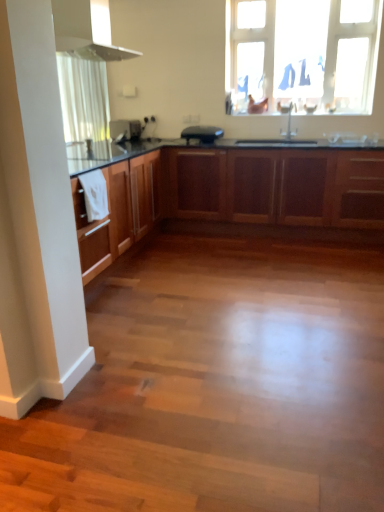
Locate an element on the screen. transparent plastic window at upper center is located at coordinates (305, 52).

Describe the element at coordinates (305, 52) in the screenshot. The image size is (384, 512). I see `transparent plastic window at upper center` at that location.

This screenshot has height=512, width=384. What are the coordinates of `white sheer curtain at upper left` in the screenshot? It's located at (83, 99).

Describe the element at coordinates (83, 99) in the screenshot. I see `white sheer curtain at upper left` at that location.

Where is `wooden cabinets at center`? Image resolution: width=384 pixels, height=512 pixels. wooden cabinets at center is located at coordinates (231, 192).

The width and height of the screenshot is (384, 512). Describe the element at coordinates (202, 133) in the screenshot. I see `black matte toaster at center, the 2th appliance positioned from the left` at that location.

Measure the distance between point (212, 131) and camera.

Point (212, 131) is 4.62 meters from camera.

Identify the location of transparent plastic window at upper center. This screenshot has width=384, height=512. (305, 52).

Is black matte toaster at center, the 2th appliance positioned from the left, to the left of satin nickel faucet at upper center from the viewer's perspective?

Yes, black matte toaster at center, the 2th appliance positioned from the left, is to the left of satin nickel faucet at upper center.

From the image's perspective, is black matte toaster at center, placed as the first appliance when sorted from right to left, located beneath satin nickel faucet at upper center?

Correct, black matte toaster at center, placed as the first appliance when sorted from right to left, appears lower than satin nickel faucet at upper center in the image.

Can you confirm if black matte toaster at center, placed as the first appliance when sorted from right to left, is taller than satin nickel faucet at upper center?

In fact, black matte toaster at center, placed as the first appliance when sorted from right to left, may be shorter than satin nickel faucet at upper center.

Is black matte toaster at center, the 2th appliance positioned from the left, facing away from satin nickel faucet at upper center?

That's not correct — black matte toaster at center, the 2th appliance positioned from the left, is not looking away from satin nickel faucet at upper center.

Is white glossy exhaust hood at upper center facing away from wooden cabinets at center?

white glossy exhaust hood at upper center does not have its back to wooden cabinets at center.

Does point (109, 16) come closer to viewer compared to point (239, 210)?

No.

Choose the correct answer: Is white glossy exhaust hood at upper center inside wooden cabinets at center or outside it?

white glossy exhaust hood at upper center is not enclosed by wooden cabinets at center.

From a real-world perspective, is white glossy exhaust hood at upper center beneath wooden cabinets at center?

No, from a real-world perspective, white glossy exhaust hood at upper center is not under wooden cabinets at center.

From the image's perspective, between white sheer curtain at upper left and satin black toaster at center, the 1th appliance viewed from the left, who is located below?

From the image's view, satin black toaster at center, the 1th appliance viewed from the left, is below.

From a real-world perspective, which is physically above, white sheer curtain at upper left or satin black toaster at center, which is the second appliance in right-to-left order?

white sheer curtain at upper left is physically above.

In order to click on curtain above the satin black toaster at center, the 1th appliance viewed from the left (from a real-world perspective) in this screenshot , I will do `click(83, 99)`.

Can you tell me how much white sheer curtain at upper left and satin black toaster at center, which is the second appliance in right-to-left order, differ in facing direction?

They differ by 82.9 degrees in their facing directions.

Considering the positions of objects white sheer curtain at upper left and black matte toaster at center, placed as the first appliance when sorted from right to left, in the image provided, who is more to the right, white sheer curtain at upper left or black matte toaster at center, placed as the first appliance when sorted from right to left,?

black matte toaster at center, placed as the first appliance when sorted from right to left.

From a real-world perspective, does white sheer curtain at upper left stand above black matte toaster at center, the 2th appliance positioned from the left?

Correct, in the physical world, white sheer curtain at upper left is higher than black matte toaster at center, the 2th appliance positioned from the left.

Relative to black matte toaster at center, the 2th appliance positioned from the left, is white sheer curtain at upper left in front or behind?

Visually, white sheer curtain at upper left is located behind black matte toaster at center, the 2th appliance positioned from the left.

Is point (69, 70) positioned before point (219, 132)?

Yes, point (69, 70) is in front of point (219, 132).

How distant is transparent plastic window at upper center from satin black toaster at center, the 1th appliance viewed from the left?

transparent plastic window at upper center and satin black toaster at center, the 1th appliance viewed from the left, are 5.93 feet apart from each other.

Would you consider transparent plastic window at upper center to be distant from satin black toaster at center, which is the second appliance in right-to-left order?

That's right, there is a large distance between transparent plastic window at upper center and satin black toaster at center, which is the second appliance in right-to-left order.

Is satin black toaster at center, the 1th appliance viewed from the left, inside transparent plastic window at upper center?

Definitely not — satin black toaster at center, the 1th appliance viewed from the left, is not inside transparent plastic window at upper center.

From their relative heights in the image, would you say transparent plastic window at upper center is taller or shorter than satin black toaster at center, which is the second appliance in right-to-left order?

Clearly, transparent plastic window at upper center is taller compared to satin black toaster at center, which is the second appliance in right-to-left order.

Which object is closer to the camera taking this photo, satin black toaster at center, which is the second appliance in right-to-left order, or black matte toaster at center, the 2th appliance positioned from the left?

Positioned in front is black matte toaster at center, the 2th appliance positioned from the left.

Is satin black toaster at center, the 1th appliance viewed from the left, aimed at black matte toaster at center, placed as the first appliance when sorted from right to left?

Yes.

Based on their sizes in the image, would you say satin black toaster at center, the 1th appliance viewed from the left, is bigger or smaller than black matte toaster at center, the 2th appliance positioned from the left?

In the image, satin black toaster at center, the 1th appliance viewed from the left, appears to be smaller than black matte toaster at center, the 2th appliance positioned from the left.

Considering the sizes of black matte toaster at center, the 2th appliance positioned from the left, and wooden cabinets at center in the image, is black matte toaster at center, the 2th appliance positioned from the left, taller or shorter than wooden cabinets at center?

In the image, black matte toaster at center, the 2th appliance positioned from the left, appears to be shorter than wooden cabinets at center.

Looking at this image, would you say black matte toaster at center, the 2th appliance positioned from the left, is outside wooden cabinets at center?

Indeed, black matte toaster at center, the 2th appliance positioned from the left, is completely outside wooden cabinets at center.

Does point (216, 132) lie behind point (127, 169)?

Yes, it is.

How many degrees apart are the facing directions of black matte toaster at center, placed as the first appliance when sorted from right to left, and wooden cabinets at center?

The facing directions of black matte toaster at center, placed as the first appliance when sorted from right to left, and wooden cabinets at center are 1.92 degrees apart.

In order to click on tap that appears above the black matte toaster at center, placed as the first appliance when sorted from right to left (from a real-world perspective) in this screenshot , I will do `click(288, 118)`.

I want to click on exhaust hood on the left of wooden cabinets at center, so click(86, 31).

Consider the image. Which object lies further to the anchor point white sheer curtain at upper left, transparent plastic window at upper center or black matte toaster at center, placed as the first appliance when sorted from right to left?

The object further to white sheer curtain at upper left is transparent plastic window at upper center.

Which object lies nearer to the anchor point black matte toaster at center, the 2th appliance positioned from the left, white glossy exhaust hood at upper center or wooden cabinets at center?

wooden cabinets at center.

Estimate the real-world distances between objects in this image. Which object is closer to satin black toaster at center, the 1th appliance viewed from the left, white sheer curtain at upper left or wooden cabinets at center?

The object closer to satin black toaster at center, the 1th appliance viewed from the left, is white sheer curtain at upper left.

Based on their spatial positions, is transparent plastic window at upper center or satin black toaster at center, which is the second appliance in right-to-left order, further from white sheer curtain at upper left?

Among the two, transparent plastic window at upper center is located further to white sheer curtain at upper left.

When comparing their distances from satin nickel faucet at upper center, does white glossy exhaust hood at upper center or white sheer curtain at upper left seem closer?

Answer: white glossy exhaust hood at upper center is closer to satin nickel faucet at upper center.

When comparing their distances from white sheer curtain at upper left, does satin nickel faucet at upper center or transparent plastic window at upper center seem further?

satin nickel faucet at upper center lies further to white sheer curtain at upper left than the other object.

Based on their spatial positions, is black matte toaster at center, the 2th appliance positioned from the left, or transparent plastic window at upper center further from white sheer curtain at upper left?

The object further to white sheer curtain at upper left is transparent plastic window at upper center.

When comparing their distances from satin black toaster at center, the 1th appliance viewed from the left, does wooden cabinets at center or white sheer curtain at upper left seem closer?

Among the two, white sheer curtain at upper left is located nearer to satin black toaster at center, the 1th appliance viewed from the left.

Identify the location of appliance situated between satin black toaster at center, the 1th appliance viewed from the left, and satin nickel faucet at upper center from left to right. The width and height of the screenshot is (384, 512). (202, 133).

Locate an element on the screen. cabinetry between white glossy exhaust hood at upper center and transparent plastic window at upper center is located at coordinates (231, 192).

Find the location of a particular element. The image size is (384, 512). tap between transparent plastic window at upper center and wooden cabinets at center vertically is located at coordinates (288, 118).

Identify the location of cabinetry between white glossy exhaust hood at upper center and black matte toaster at center, the 2th appliance positioned from the left, along the z-axis. The height and width of the screenshot is (512, 384). (231, 192).